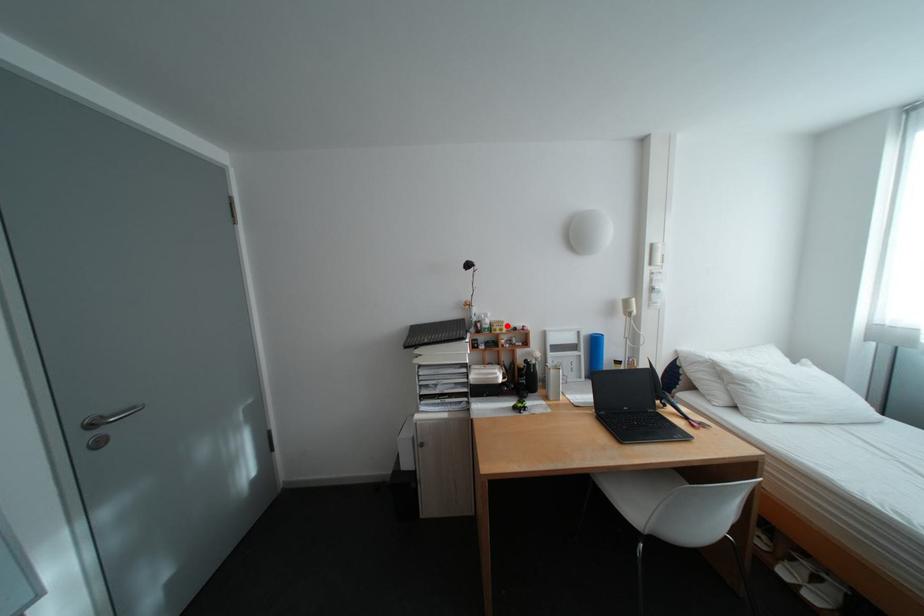
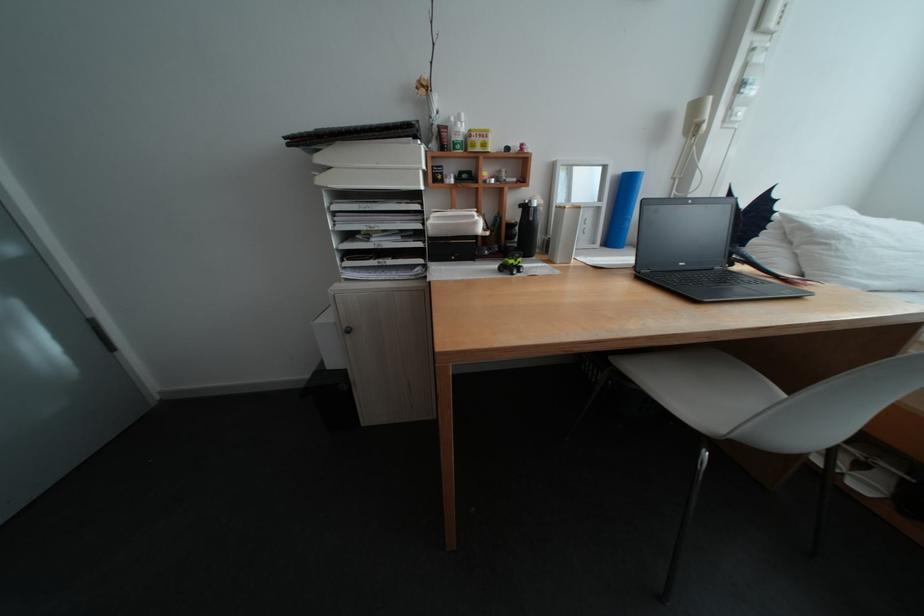
Question: A red point is marked in image1. In image2, is the corresponding 3D point closer to the camera or farther? Reply with the corresponding letter.

Choices:
 (A) The corresponding 3D point is closer.
 (B) The corresponding 3D point is farther.

Answer: (A)